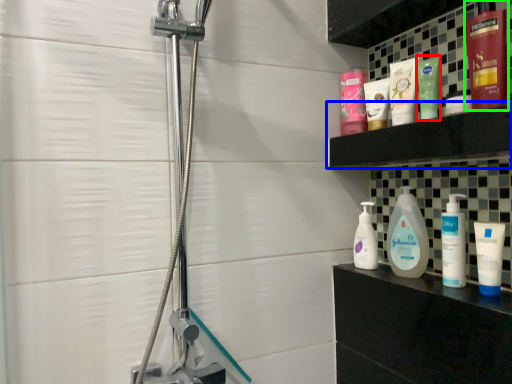
Question: Which is farther away from toiletry (highlighted by a red box)? shelf (highlighted by a blue box) or toiletry (highlighted by a green box)?

Choices:
 (A) shelf
 (B) toiletry

Answer: (B)